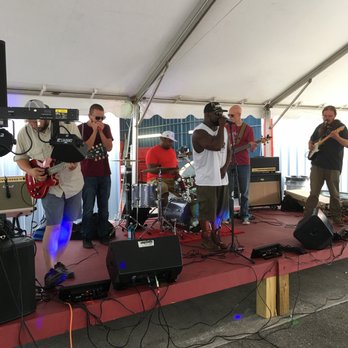
Where is `canopy`? Image resolution: width=348 pixels, height=348 pixels. canopy is located at coordinates (238, 85).